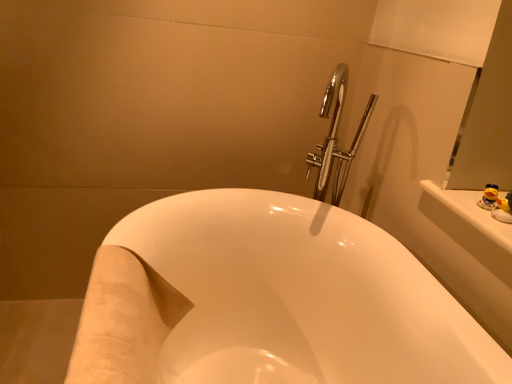
Measure the distance between white glossy bathtub at center and camera.

white glossy bathtub at center and camera are 26.27 inches apart from each other.

In order to click on white glossy bathtub at center in this screenshot , I will do `click(271, 296)`.

Does yellow rubber duck at upper right, the second toy positioned from the front, have a greater height compared to white glossy bathtub at center?

No.

From the image's perspective, is yellow rubber duck at upper right, the second toy positioned from the front, over white glossy bathtub at center?

Indeed, from the image's perspective, yellow rubber duck at upper right, the second toy positioned from the front, is shown above white glossy bathtub at center.

Considering the points (495, 191) and (334, 274), which point is in front, point (495, 191) or point (334, 274)?

The point (495, 191) is closer to the camera.

How many degrees apart are the facing directions of white glossy bathtub at center and yellow rubber duck at upper right, which is the 1th toy from back to front?

The angle between the facing direction of white glossy bathtub at center and the facing direction of yellow rubber duck at upper right, which is the 1th toy from back to front, is 0.0895 degrees.

Between white glossy bathtub at center and yellow rubber duck at upper right, which is the 1th toy from back to front, which one has smaller width?

Thinner between the two is yellow rubber duck at upper right, which is the 1th toy from back to front.

Considering the sizes of objects white glossy bathtub at center and yellow rubber duck at upper right, the second toy positioned from the front, in the image provided, who is shorter, white glossy bathtub at center or yellow rubber duck at upper right, the second toy positioned from the front,?

yellow rubber duck at upper right, the second toy positioned from the front, is shorter.

Is white glossy bathtub at center aimed at yellow rubber duck at upper right, the second toy positioned from the front?

No, white glossy bathtub at center is not oriented towards yellow rubber duck at upper right, the second toy positioned from the front.

Is the position of white glossy bathtub at center less distant than that of yellow rubber duck at upper right, which appears as the 2th toy when viewed from the back?

Yes.

Would you say white glossy bathtub at center is inside or outside yellow rubber duck at upper right, which appears as the 2th toy when viewed from the back?

white glossy bathtub at center is spatially situated outside yellow rubber duck at upper right, which appears as the 2th toy when viewed from the back.

Is white glossy bathtub at center positioned with its back to yellow rubber duck at upper right, arranged as the 1th toy when viewed from the front?

No, white glossy bathtub at center is not facing the opposite direction of yellow rubber duck at upper right, arranged as the 1th toy when viewed from the front.

Starting from the white glossy bathtub at center, which toy is the 1st one to the right? Please provide its 2D coordinates.

[(503, 209)]

Are yellow rubber duck at upper right, which appears as the 2th toy when viewed from the back, and white glossy bathtub at center located far from each other?

No, yellow rubber duck at upper right, which appears as the 2th toy when viewed from the back, is not far away from white glossy bathtub at center.

From the image's perspective, which one is positioned higher, yellow rubber duck at upper right, arranged as the 1th toy when viewed from the front, or white glossy bathtub at center?

yellow rubber duck at upper right, arranged as the 1th toy when viewed from the front, appears higher in the image.

Which is in front, point (508, 218) or point (165, 351)?

The point (508, 218) is more forward.

Consider the image. Considering the relative positions of yellow rubber duck at upper right, which appears as the 2th toy when viewed from the back, and white glossy bathtub at center in the image provided, is yellow rubber duck at upper right, which appears as the 2th toy when viewed from the back, behind white glossy bathtub at center?

Yes, it is behind white glossy bathtub at center.

Is yellow rubber duck at upper right, arranged as the 1th toy when viewed from the front, completely or partially inside yellow rubber duck at upper right, the second toy positioned from the front?

Definitely not — yellow rubber duck at upper right, arranged as the 1th toy when viewed from the front, is not inside yellow rubber duck at upper right, the second toy positioned from the front.

Are yellow rubber duck at upper right, the second toy positioned from the front, and yellow rubber duck at upper right, arranged as the 1th toy when viewed from the front, beside each other?

Yes, yellow rubber duck at upper right, the second toy positioned from the front, is with yellow rubber duck at upper right, arranged as the 1th toy when viewed from the front.

Considering the relative sizes of yellow rubber duck at upper right, the second toy positioned from the front, and yellow rubber duck at upper right, arranged as the 1th toy when viewed from the front, in the image provided, is yellow rubber duck at upper right, the second toy positioned from the front, taller than yellow rubber duck at upper right, arranged as the 1th toy when viewed from the front,?

In fact, yellow rubber duck at upper right, the second toy positioned from the front, may be shorter than yellow rubber duck at upper right, arranged as the 1th toy when viewed from the front.

Is yellow rubber duck at upper right, which is the 1th toy from back to front, positioned with its back to yellow rubber duck at upper right, which appears as the 2th toy when viewed from the back?

yellow rubber duck at upper right, which is the 1th toy from back to front, is not turned away from yellow rubber duck at upper right, which appears as the 2th toy when viewed from the back.

Which of these two, yellow rubber duck at upper right, arranged as the 1th toy when viewed from the front, or yellow rubber duck at upper right, the second toy positioned from the front, is bigger?

yellow rubber duck at upper right, the second toy positioned from the front, is bigger.

From their relative heights in the image, would you say yellow rubber duck at upper right, arranged as the 1th toy when viewed from the front, is taller or shorter than yellow rubber duck at upper right, the second toy positioned from the front?

Clearly, yellow rubber duck at upper right, arranged as the 1th toy when viewed from the front, is taller compared to yellow rubber duck at upper right, the second toy positioned from the front.

Based on the photo, can you confirm if yellow rubber duck at upper right, arranged as the 1th toy when viewed from the front, is thinner than yellow rubber duck at upper right, which is the 1th toy from back to front?

Indeed, yellow rubber duck at upper right, arranged as the 1th toy when viewed from the front, has a lesser width compared to yellow rubber duck at upper right, which is the 1th toy from back to front.

From a real-world perspective, which is physically below, yellow rubber duck at upper right, which appears as the 2th toy when viewed from the back, or yellow rubber duck at upper right, the second toy positioned from the front?

In real-world perspective, yellow rubber duck at upper right, the second toy positioned from the front, is lower.

You are a GUI agent. You are given a task and a screenshot of the screen. Output one action in this format:
    pyautogui.click(x=<x>, y=<y>)
    Task: Click on the toy that is the 2nd one when counting upward from the white glossy bathtub at center (from the image's perspective)
    The height and width of the screenshot is (384, 512).
    Given the screenshot: What is the action you would take?
    pyautogui.click(x=493, y=199)

Where is `bathtub below the yellow rubber duck at upper right, which is the 1th toy from back to front (from the image's perspective)`? This screenshot has width=512, height=384. bathtub below the yellow rubber duck at upper right, which is the 1th toy from back to front (from the image's perspective) is located at coordinates (271, 296).

From the image, which object appears to be farther from white glossy bathtub at center, yellow rubber duck at upper right, which is the 1th toy from back to front, or yellow rubber duck at upper right, arranged as the 1th toy when viewed from the front?

yellow rubber duck at upper right, arranged as the 1th toy when viewed from the front, is further to white glossy bathtub at center.

Considering their positions, is white glossy bathtub at center positioned further to yellow rubber duck at upper right, arranged as the 1th toy when viewed from the front, than yellow rubber duck at upper right, the second toy positioned from the front?

white glossy bathtub at center lies further to yellow rubber duck at upper right, arranged as the 1th toy when viewed from the front, than the other object.

Looking at the image, which one is located further to white glossy bathtub at center, yellow rubber duck at upper right, which appears as the 2th toy when viewed from the back, or yellow rubber duck at upper right, which is the 1th toy from back to front?

The object further to white glossy bathtub at center is yellow rubber duck at upper right, which appears as the 2th toy when viewed from the back.

When comparing their distances from yellow rubber duck at upper right, which is the 1th toy from back to front, does white glossy bathtub at center or yellow rubber duck at upper right, which appears as the 2th toy when viewed from the back, seem closer?

Based on the image, yellow rubber duck at upper right, which appears as the 2th toy when viewed from the back, appears to be nearer to yellow rubber duck at upper right, which is the 1th toy from back to front.

Looking at the image, which one is located further to yellow rubber duck at upper right, the second toy positioned from the front, yellow rubber duck at upper right, which appears as the 2th toy when viewed from the back, or white glossy bathtub at center?

Among the two, white glossy bathtub at center is located further to yellow rubber duck at upper right, the second toy positioned from the front.

Estimate the real-world distances between objects in this image. Which object is closer to yellow rubber duck at upper right, which appears as the 2th toy when viewed from the back, yellow rubber duck at upper right, which is the 1th toy from back to front, or white glossy bathtub at center?

yellow rubber duck at upper right, which is the 1th toy from back to front, is positioned closer to the anchor yellow rubber duck at upper right, which appears as the 2th toy when viewed from the back.

The image size is (512, 384). I want to click on toy between white glossy bathtub at center and yellow rubber duck at upper right, the second toy positioned from the front, in the horizontal direction, so click(x=503, y=209).